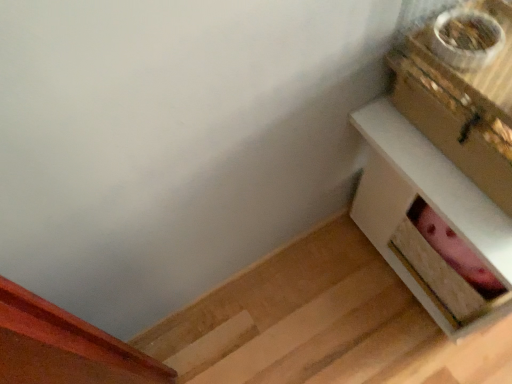
Question: Is white wood table at right closer to the viewer compared to gold metallic box at upper right?

Choices:
 (A) no
 (B) yes

Answer: (A)

Question: From the image's perspective, is white wood table at right located above gold metallic box at upper right?

Choices:
 (A) yes
 (B) no

Answer: (B)

Question: Is gold metallic box at upper right surrounded by white wood table at right?

Choices:
 (A) no
 (B) yes

Answer: (A)

Question: Can you confirm if white wood table at right is positioned to the right of gold metallic box at upper right?

Choices:
 (A) yes
 (B) no

Answer: (A)

Question: Can you confirm if white wood table at right is shorter than gold metallic box at upper right?

Choices:
 (A) yes
 (B) no

Answer: (B)

Question: Considering the relative sizes of white wood table at right and gold metallic box at upper right in the image provided, is white wood table at right thinner than gold metallic box at upper right?

Choices:
 (A) no
 (B) yes

Answer: (A)

Question: Does gold metallic box at upper right have a greater width compared to white wood table at right?

Choices:
 (A) no
 (B) yes

Answer: (A)

Question: Can you confirm if gold metallic box at upper right is positioned to the left of white wood table at right?

Choices:
 (A) no
 (B) yes

Answer: (B)

Question: Considering the relative sizes of gold metallic box at upper right and white wood table at right in the image provided, is gold metallic box at upper right thinner than white wood table at right?

Choices:
 (A) yes
 (B) no

Answer: (A)

Question: Can you confirm if gold metallic box at upper right is positioned to the right of white wood table at right?

Choices:
 (A) no
 (B) yes

Answer: (A)

Question: Considering the relative sizes of gold metallic box at upper right and white wood table at right in the image provided, is gold metallic box at upper right bigger than white wood table at right?

Choices:
 (A) no
 (B) yes

Answer: (A)

Question: From the image's perspective, is gold metallic box at upper right located beneath white wood table at right?

Choices:
 (A) no
 (B) yes

Answer: (A)

Question: In terms of width, does white wood table at right look wider or thinner when compared to gold metallic box at upper right?

Choices:
 (A) thin
 (B) wide

Answer: (B)